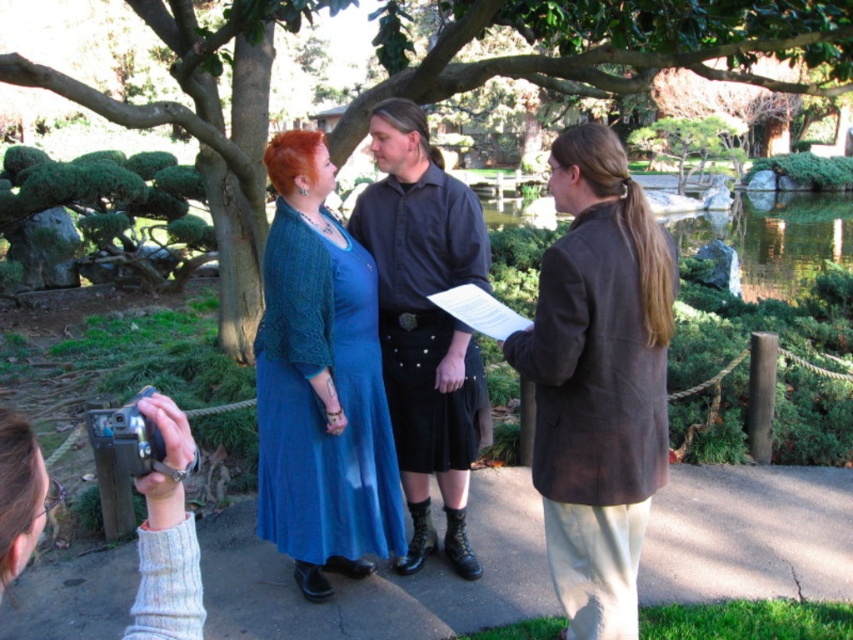
Question: From the image, what is the correct spatial relationship of brown suede jacket at right in relation to black matte shirt at center?

Choices:
 (A) above
 (B) below

Answer: (B)

Question: Which point is closer to the camera?

Choices:
 (A) (763, 84)
 (B) (393, 264)

Answer: (B)

Question: Can you confirm if brown suede jacket at right is positioned to the right of blue knitted dress at center?

Choices:
 (A) yes
 (B) no

Answer: (A)

Question: Which of these objects is positioned farthest from the green leafy tree at center?

Choices:
 (A) blue knitted dress at center
 (B) brown suede jacket at right

Answer: (B)

Question: Can you confirm if blue knitted dress at center is positioned above black matte shirt at center?

Choices:
 (A) yes
 (B) no

Answer: (B)

Question: Among these objects, which one is nearest to the camera?

Choices:
 (A) green leafy tree at center
 (B) black matte shirt at center
 (C) blue knitted dress at center
 (D) brown suede jacket at right

Answer: (D)